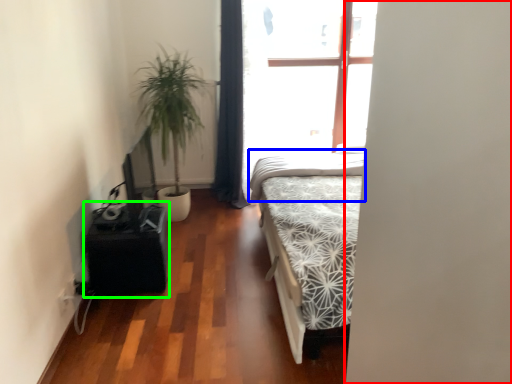
Question: Based on their relative distances, which object is nearer to screen door (highlighted by a red box)? Choose from mattress (highlighted by a blue box) and table (highlighted by a green box).

Choices:
 (A) mattress
 (B) table

Answer: (B)